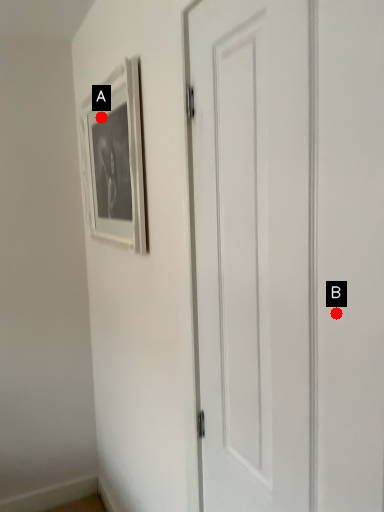
Question: Two points are circled on the image, labeled by A and B beside each circle. Which of the following is the closest to the observer?

Choices:
 (A) A is closer
 (B) B is closer

Answer: (B)